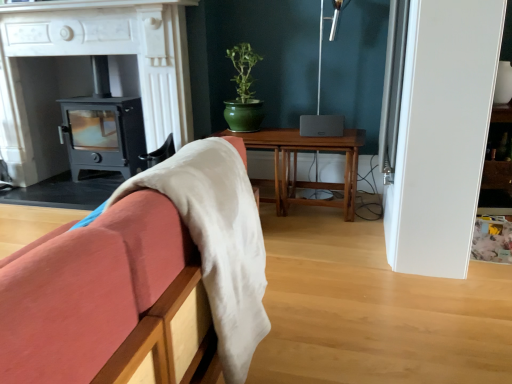
Question: Does matte black wood burning stove at left have a lesser width compared to wooden table at center?

Choices:
 (A) no
 (B) yes

Answer: (B)

Question: Is matte black wood burning stove at left directly adjacent to wooden table at center?

Choices:
 (A) no
 (B) yes

Answer: (A)

Question: From the image's perspective, is matte black wood burning stove at left under wooden table at center?

Choices:
 (A) yes
 (B) no

Answer: (B)

Question: Does matte black wood burning stove at left turn towards wooden table at center?

Choices:
 (A) no
 (B) yes

Answer: (A)

Question: Considering the relative sizes of matte black wood burning stove at left and wooden table at center in the image provided, is matte black wood burning stove at left wider than wooden table at center?

Choices:
 (A) no
 (B) yes

Answer: (A)

Question: Considering the positions of white marble fireplace at center and wooden table at center in the image, is white marble fireplace at center bigger or smaller than wooden table at center?

Choices:
 (A) big
 (B) small

Answer: (A)

Question: From the image's perspective, relative to wooden table at center, is white marble fireplace at center above or below?

Choices:
 (A) above
 (B) below

Answer: (A)

Question: Considering the positions of point (142, 114) and point (292, 168), is point (142, 114) closer or farther from the camera than point (292, 168)?

Choices:
 (A) farther
 (B) closer

Answer: (B)

Question: In the image, is white marble fireplace at center positioned in front of or behind wooden table at center?

Choices:
 (A) behind
 (B) front

Answer: (B)

Question: From a real-world perspective, is wooden table at center physically located above or below white marble fireplace at center?

Choices:
 (A) above
 (B) below

Answer: (B)

Question: Is wooden table at center bigger or smaller than white marble fireplace at center?

Choices:
 (A) small
 (B) big

Answer: (A)

Question: Looking at their shapes, would you say wooden table at center is wider or thinner than white marble fireplace at center?

Choices:
 (A) wide
 (B) thin

Answer: (B)

Question: In the image, is wooden table at center on the left side or the right side of white marble fireplace at center?

Choices:
 (A) right
 (B) left

Answer: (A)

Question: From a real-world perspective, is wooden sofa at left above or below matte black wood burning stove at left?

Choices:
 (A) above
 (B) below

Answer: (A)

Question: Is wooden sofa at left wider or thinner than matte black wood burning stove at left?

Choices:
 (A) thin
 (B) wide

Answer: (B)